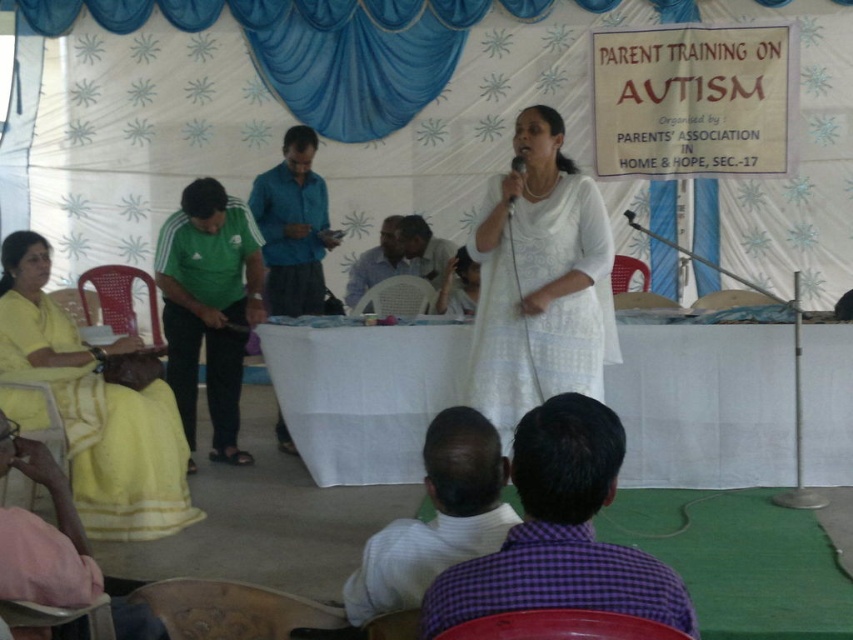
You are a photographer at the Parent Training on Autism event. You need to take a photo of the white cloth table at center and the white striped shirt at lower center. The camera you are using has a minimum focus distance of 7 feet. Can you capture both objects in focus without moving the camera or the objects?

The white cloth table at center and the white striped shirt at lower center are 8.03 feet apart. Since the minimum focus distance is 7 feet, the camera can focus on both objects as they are within the required distance.

You are organizing a small workshop for 10 participants and need to decide which object between the white cloth table at center and the pink fabric at lower left can accommodate more people. Based on their sizes, which one would you choose?

The pink fabric at lower left can accommodate more people since it has a larger size compared to the white cloth table at center.